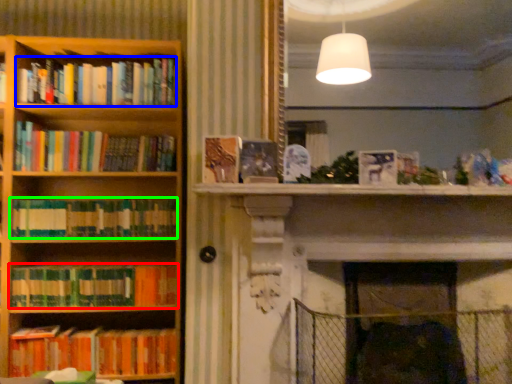
Question: Which object is positioned closest to book (highlighted by a red box)? Select from book (highlighted by a blue box) and book (highlighted by a green box).

Choices:
 (A) book
 (B) book

Answer: (B)